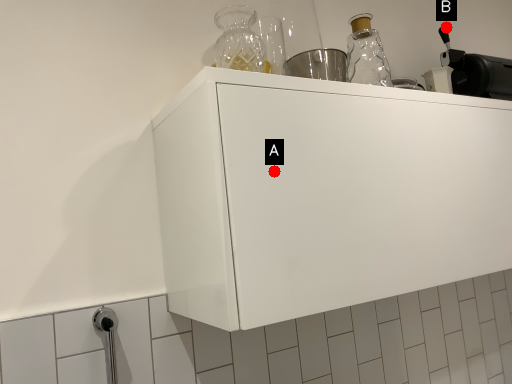
Question: Two points are circled on the image, labeled by A and B beside each circle. Which point is further to the camera?

Choices:
 (A) A is further
 (B) B is further

Answer: (B)